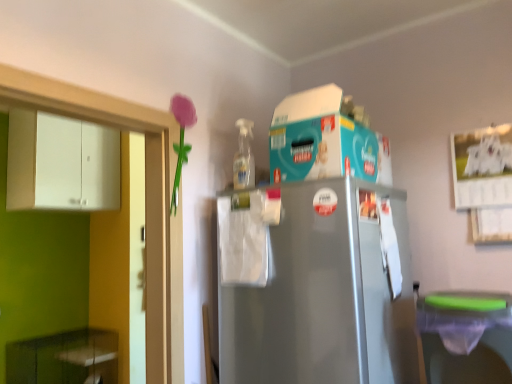
Question: From a real-world perspective, is green glossy cabinet at lower left, marked as the first cabinetry in a bottom-to-top arrangement, physically below white matte cabinet at left, which is the 2th cabinetry from bottom to top?

Choices:
 (A) no
 (B) yes

Answer: (B)

Question: Does green glossy cabinet at lower left, marked as the first cabinetry in a bottom-to-top arrangement, contain white matte cabinet at left, the first cabinetry in the top-to-bottom sequence?

Choices:
 (A) yes
 (B) no

Answer: (B)

Question: Could you tell me if green glossy cabinet at lower left, marked as the first cabinetry in a bottom-to-top arrangement, is facing white matte cabinet at left, the first cabinetry in the top-to-bottom sequence?

Choices:
 (A) yes
 (B) no

Answer: (B)

Question: Is green glossy cabinet at lower left, marked as the first cabinetry in a bottom-to-top arrangement, not within white matte cabinet at left, the first cabinetry in the top-to-bottom sequence?

Choices:
 (A) no
 (B) yes

Answer: (B)

Question: Is green glossy cabinet at lower left, placed as the 2th cabinetry when sorted from top to bottom, not close to white matte cabinet at left, which is the 2th cabinetry from bottom to top?

Choices:
 (A) yes
 (B) no

Answer: (A)

Question: Is green glossy cabinet at lower left, marked as the first cabinetry in a bottom-to-top arrangement, at the left side of white matte cabinet at left, which is the 2th cabinetry from bottom to top?

Choices:
 (A) yes
 (B) no

Answer: (A)

Question: Considering the relative sizes of matte plastic flower at upper left and green glossy cabinet at lower left, marked as the first cabinetry in a bottom-to-top arrangement, in the image provided, is matte plastic flower at upper left bigger than green glossy cabinet at lower left, marked as the first cabinetry in a bottom-to-top arrangement,?

Choices:
 (A) no
 (B) yes

Answer: (A)

Question: Can you confirm if matte plastic flower at upper left is wider than green glossy cabinet at lower left, marked as the first cabinetry in a bottom-to-top arrangement?

Choices:
 (A) no
 (B) yes

Answer: (A)

Question: Does matte plastic flower at upper left have a smaller size compared to green glossy cabinet at lower left, placed as the 2th cabinetry when sorted from top to bottom?

Choices:
 (A) no
 (B) yes

Answer: (B)

Question: From the image's perspective, would you say matte plastic flower at upper left is shown under green glossy cabinet at lower left, marked as the first cabinetry in a bottom-to-top arrangement?

Choices:
 (A) no
 (B) yes

Answer: (A)

Question: Is matte plastic flower at upper left shorter than green glossy cabinet at lower left, placed as the 2th cabinetry when sorted from top to bottom?

Choices:
 (A) yes
 (B) no

Answer: (B)

Question: Would you consider matte plastic flower at upper left to be distant from green glossy cabinet at lower left, marked as the first cabinetry in a bottom-to-top arrangement?

Choices:
 (A) yes
 (B) no

Answer: (A)

Question: Is white matte cabinet at left, which is the 2th cabinetry from bottom to top, positioned in front of matte plastic flower at upper left?

Choices:
 (A) yes
 (B) no

Answer: (B)